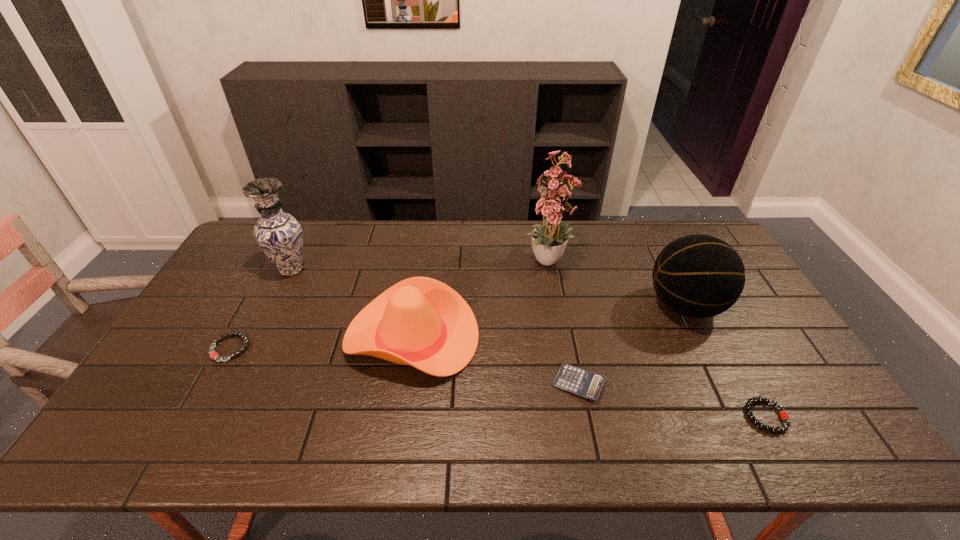
This screenshot has height=540, width=960. What are the coordinates of `free region located on the front of the third tallest object` in the screenshot? It's located at (746, 429).

Locate an element on the screen. This screenshot has height=540, width=960. vacant space located 0.080m on the right of the cowboy hat is located at coordinates (507, 337).

Identify the location of free region located on the right of the calculator. The height and width of the screenshot is (540, 960). (738, 383).

The width and height of the screenshot is (960, 540). I want to click on blank space located on the back of the left bracelet, so click(252, 306).

Locate an element on the screen. This screenshot has height=540, width=960. free space located 0.220m on the left of the nearer bracelet is located at coordinates [x=654, y=416].

Locate an element on the screen. Image resolution: width=960 pixels, height=540 pixels. flower arrangement located at the far edge is located at coordinates click(x=550, y=199).

Find the location of a particular element. This screenshot has width=960, height=540. vase at the far edge is located at coordinates (279, 234).

The width and height of the screenshot is (960, 540). What are the coordinates of `object that is at the near edge` in the screenshot? It's located at (784, 415).

Where is `vase that is positioned at the left edge`? The image size is (960, 540). vase that is positioned at the left edge is located at coordinates (279, 234).

Locate an element on the screen. The width and height of the screenshot is (960, 540). bracelet that is positioned at the left edge is located at coordinates (213, 355).